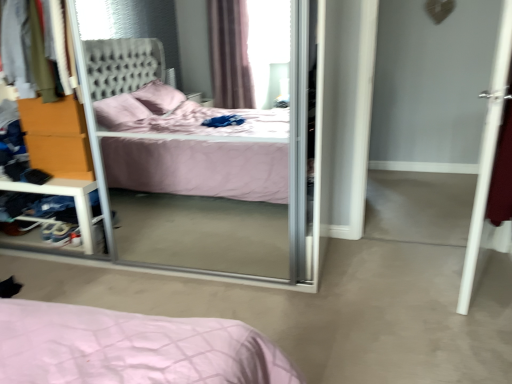
Question: From the image's perspective, would you say velvet fabric sweater at upper left is shown under white smooth door at right?

Choices:
 (A) yes
 (B) no

Answer: (B)

Question: Considering the relative sizes of velvet fabric sweater at upper left and white smooth door at right in the image provided, is velvet fabric sweater at upper left taller than white smooth door at right?

Choices:
 (A) no
 (B) yes

Answer: (A)

Question: Is velvet fabric sweater at upper left facing away from white smooth door at right?

Choices:
 (A) yes
 (B) no

Answer: (B)

Question: Is velvet fabric sweater at upper left to the right of white smooth door at right from the viewer's perspective?

Choices:
 (A) no
 (B) yes

Answer: (A)

Question: From the image's perspective, does velvet fabric sweater at upper left appear higher than white smooth door at right?

Choices:
 (A) yes
 (B) no

Answer: (A)

Question: Based on their sizes in the image, would you say velvet fabric sweater at upper left is bigger or smaller than transparent glass screen door at center?

Choices:
 (A) big
 (B) small

Answer: (B)

Question: Is velvet fabric sweater at upper left in front of or behind transparent glass screen door at center in the image?

Choices:
 (A) front
 (B) behind

Answer: (B)

Question: From the image's perspective, is velvet fabric sweater at upper left located above or below transparent glass screen door at center?

Choices:
 (A) above
 (B) below

Answer: (A)

Question: Would you say velvet fabric sweater at upper left is to the left or to the right of transparent glass screen door at center in the picture?

Choices:
 (A) left
 (B) right

Answer: (A)

Question: In terms of height, does transparent glass screen door at center look taller or shorter compared to clear plastic shelf at left?

Choices:
 (A) tall
 (B) short

Answer: (A)

Question: Is transparent glass screen door at center in front of or behind clear plastic shelf at left in the image?

Choices:
 (A) behind
 (B) front

Answer: (B)

Question: Is transparent glass screen door at center situated inside clear plastic shelf at left or outside?

Choices:
 (A) inside
 (B) outside

Answer: (B)

Question: From a real-world perspective, is transparent glass screen door at center positioned above or below clear plastic shelf at left?

Choices:
 (A) below
 (B) above

Answer: (B)

Question: Looking at the image, does orange wood dresser at left seem bigger or smaller compared to transparent glass screen door at center?

Choices:
 (A) small
 (B) big

Answer: (A)

Question: In terms of height, does orange wood dresser at left look taller or shorter compared to transparent glass screen door at center?

Choices:
 (A) short
 (B) tall

Answer: (A)